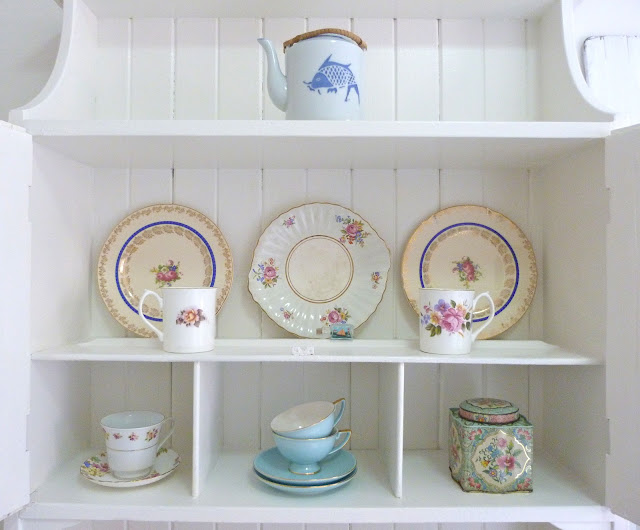
Identify the location of floral plates. (170, 253), (317, 256), (463, 253), (114, 482).